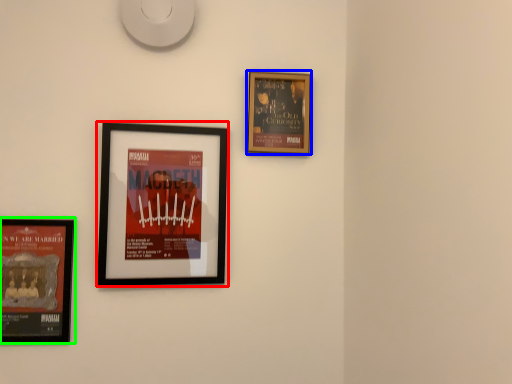
Question: Which is nearer to the picture frame (highlighted by a red box)? picture frame (highlighted by a blue box) or picture frame (highlighted by a green box).

Choices:
 (A) picture frame
 (B) picture frame

Answer: (B)